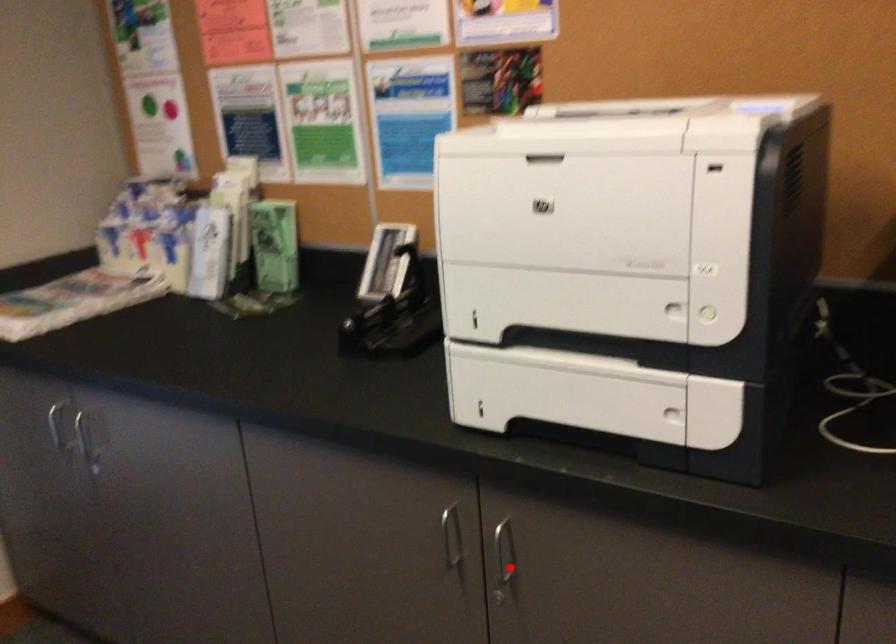
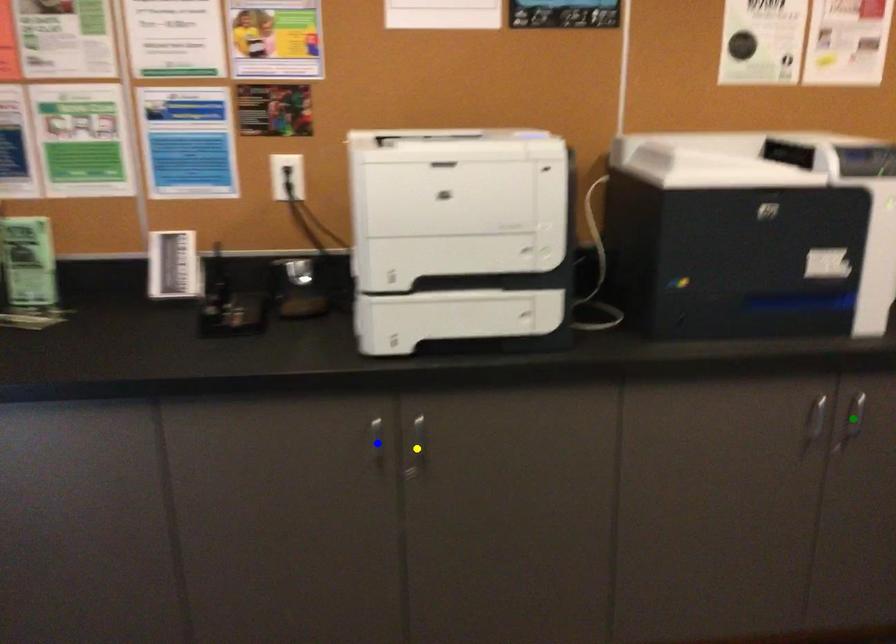
Question: I am providing you with two images of the same scene from different viewpoints. A red point is marked on the first image. You are given multiple points on the second image. Which mark in image 2 goes with the point in image 1?

Choices:
 (A) blue point
 (B) yellow point
 (C) green point

Answer: (B)